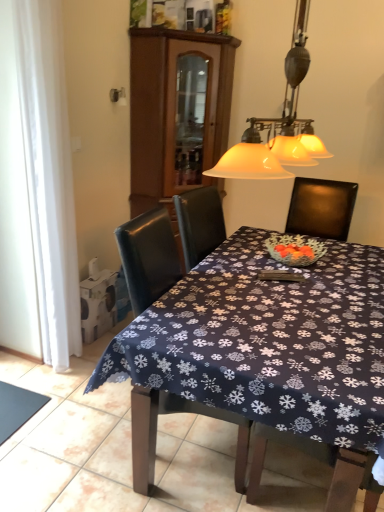
At what (x,y) coordinates should I click in order to perform the action: click on free point in front of white sheer curtain at left. Please return your answer as a coordinate pair (x, y). Looking at the image, I should click on (58, 379).